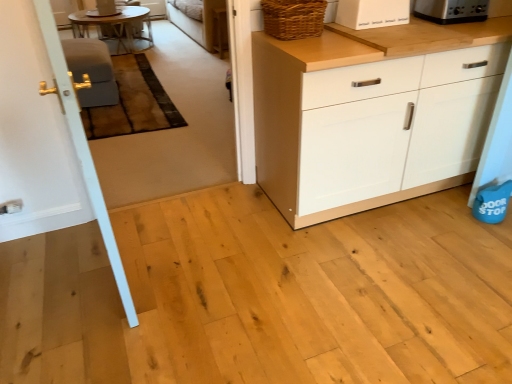
Image resolution: width=512 pixels, height=384 pixels. I want to click on free location in front of satin silver toaster at upper right, which appears as the first appliance when viewed from the right, so click(x=462, y=26).